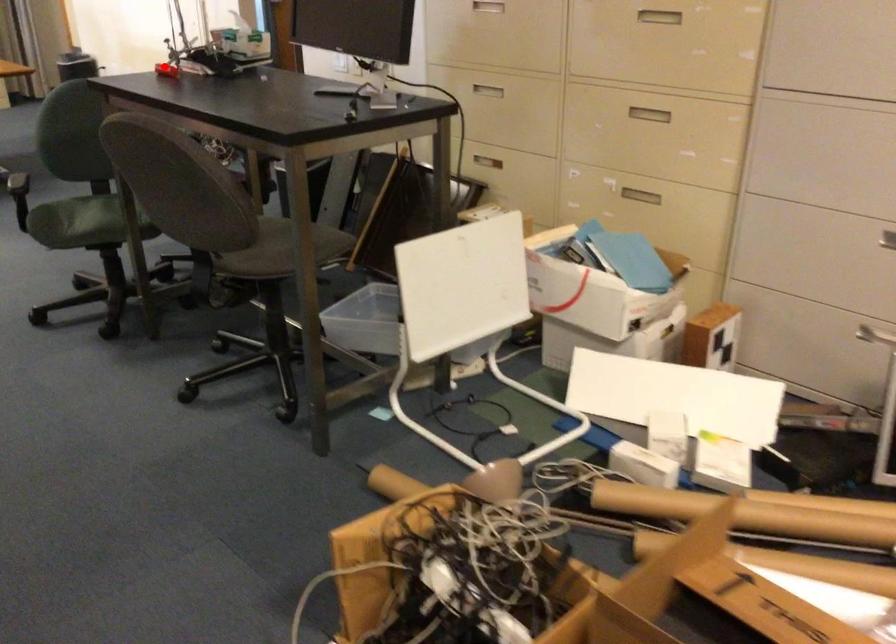
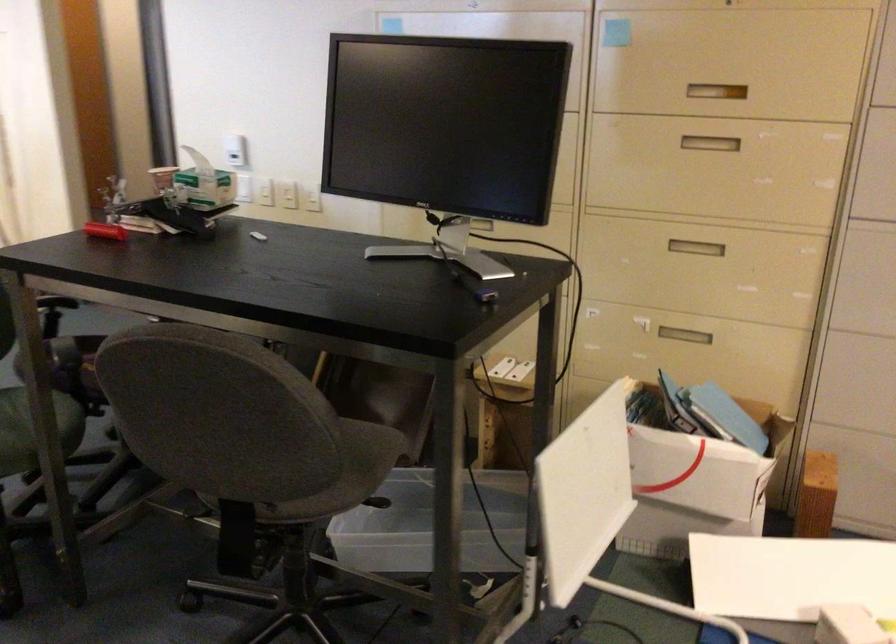
Where in the second image is the point corresponding to the highlighted location from the first image?

(104, 231)